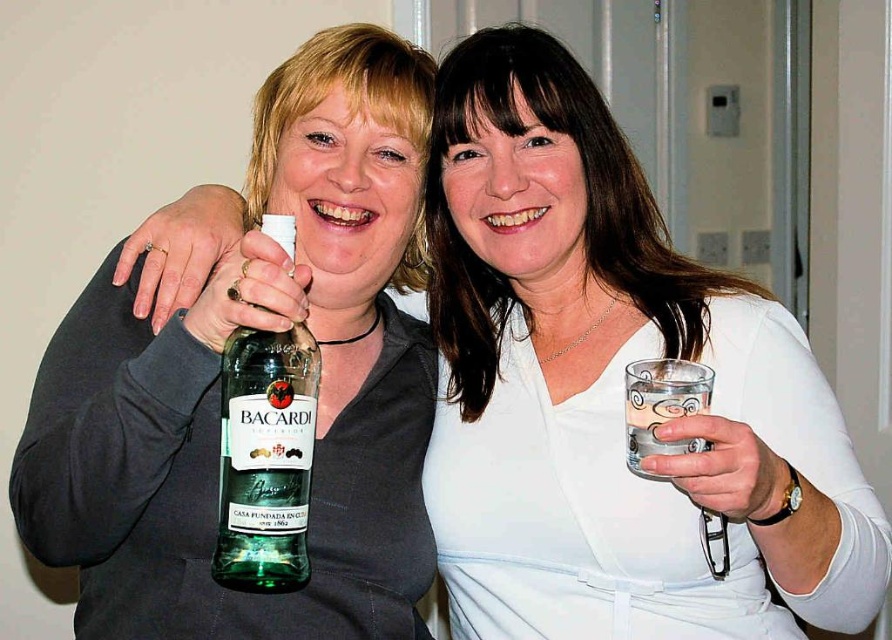
Question: Can you confirm if green glass bottle at center is thinner than clear glass at right?

Choices:
 (A) yes
 (B) no

Answer: (B)

Question: Which object is the closest to the green glass bottle at center?

Choices:
 (A) clear glass at right
 (B) green glass bottle at left

Answer: (B)

Question: Is green glass bottle at center wider than clear glass at right?

Choices:
 (A) yes
 (B) no

Answer: (A)

Question: Which of the following is the closest to the observer?

Choices:
 (A) (142, 442)
 (B) (669, 365)

Answer: (B)

Question: Which of the following is the closest to the observer?

Choices:
 (A) green glass bottle at left
 (B) clear glass at right
 (C) green glass bottle at center

Answer: (B)

Question: Can you confirm if green glass bottle at left is positioned to the right of green glass bottle at center?

Choices:
 (A) no
 (B) yes

Answer: (B)